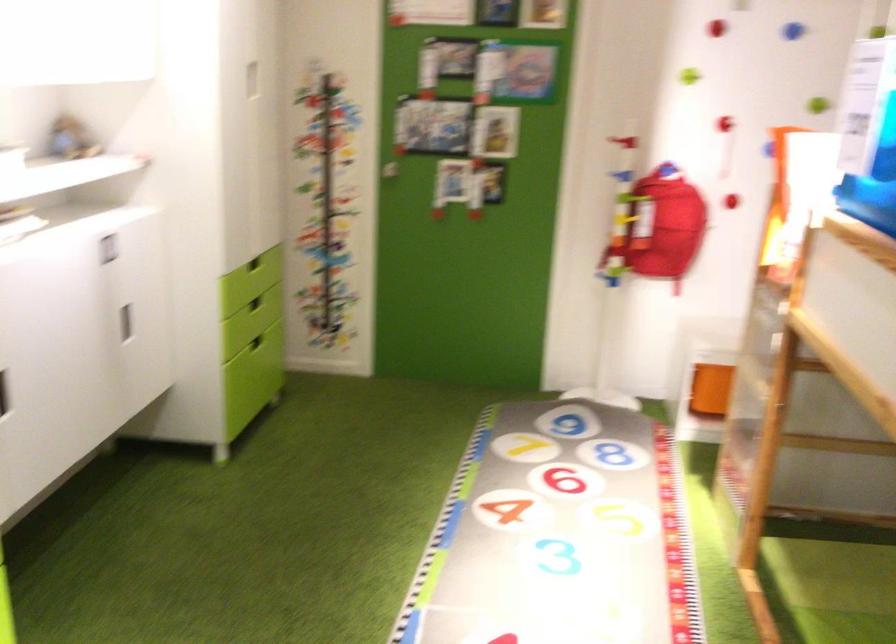
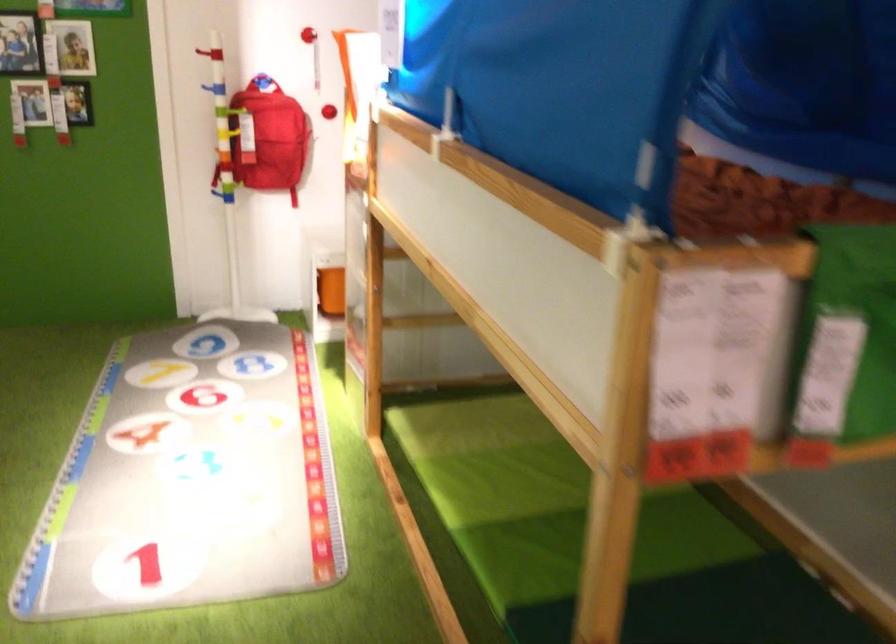
The images are taken continuously from a first-person perspective. In which direction are you moving?

The cameraman walked toward right, backward.